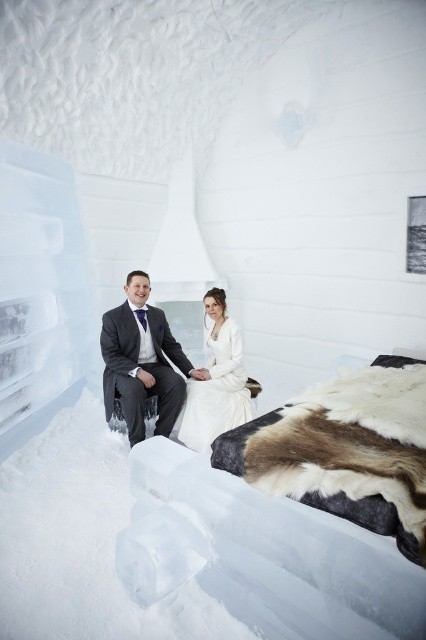
Which is above, matte gray suit at left or white satin dress at center?

matte gray suit at left is above.

Between matte gray suit at left and white satin dress at center, which one is positioned lower?

white satin dress at center is below.

Is point (146, 282) in front of point (221, 384)?

Yes, point (146, 282) is closer to viewer.

Where is `matte gray suit at left`? matte gray suit at left is located at coordinates (141, 362).